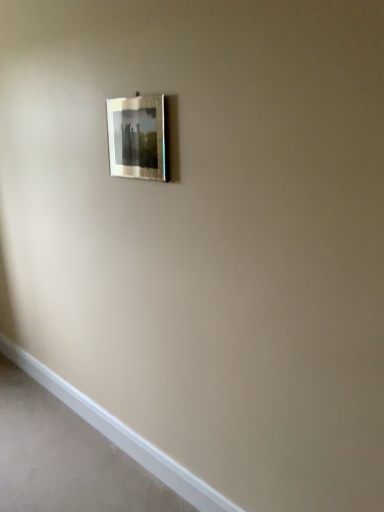
Question: Should I look upward or downward to see metallic silver frame at upper center?

Choices:
 (A) down
 (B) up

Answer: (B)